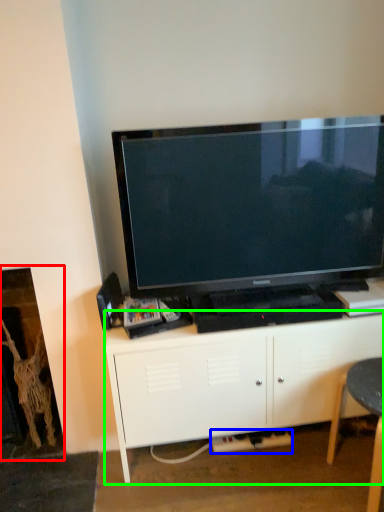
Question: Estimate the real-world distances between objects in this image. Which object is farther from fireplace (highlighted by a red box), plug (highlighted by a blue box) or cabinetry (highlighted by a green box)?

Choices:
 (A) plug
 (B) cabinetry

Answer: (A)